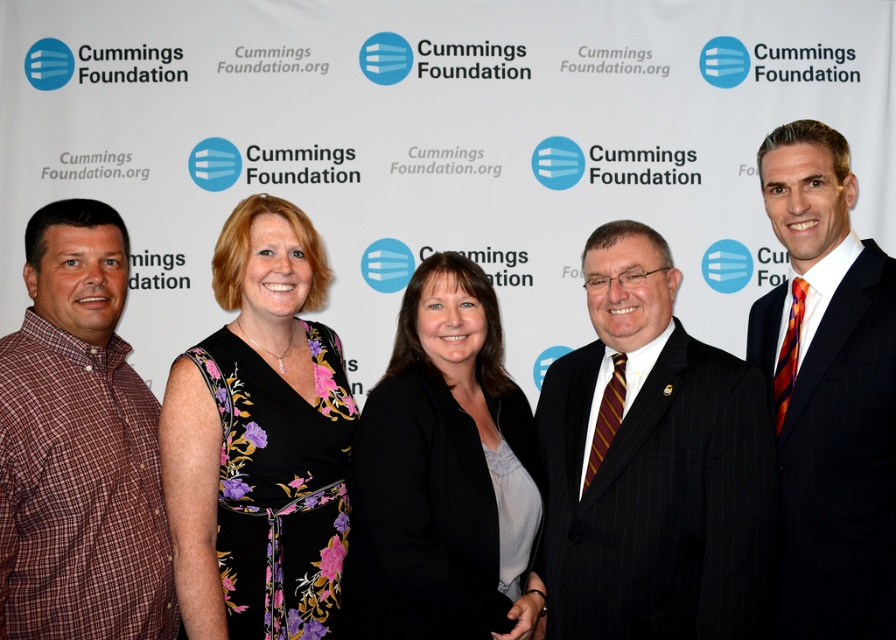
You are standing at the point labeled point (653, 468). Which object are you touching?

You are touching the black pinstripe suit at center.

You are at the Cummings Foundation event and need to identify the person in the black pinstripe suit at center. Is this person standing behind or in front of the person wearing the black floral dress at center?

The black pinstripe suit at center is in front of the black floral dress at center, so the person in the black pinstripe suit at center is standing in front of the person in the black floral dress at center.

You are a photographer at the Cummings Foundation event. You need to ensure that the black floral dress at center and the plaid cotton shirt at left are both visible in the photo. Given their sizes, which one might require more space in the frame?

The black floral dress at center is larger than the plaid cotton shirt at left, so it would require more space in the frame to ensure visibility.